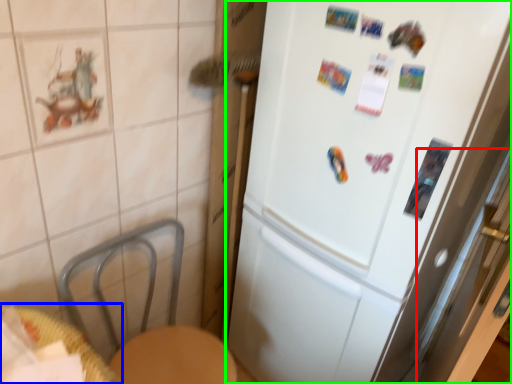
Question: Estimate the real-world distances between objects in this image. Which object is farther from screen door (highlighted by a red box), table (highlighted by a blue box) or refrigerator (highlighted by a green box)?

Choices:
 (A) table
 (B) refrigerator

Answer: (A)